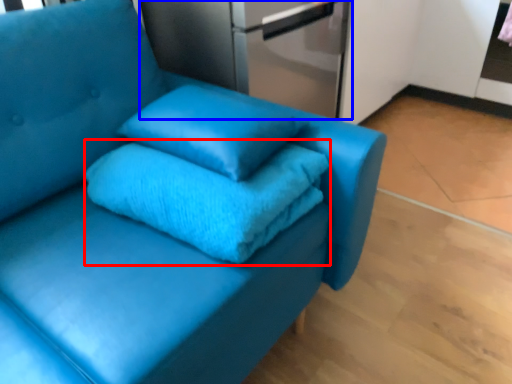
Question: Which of the following is the closest to the observer, bath towel (highlighted by a red box) or appliance (highlighted by a blue box)?

Choices:
 (A) bath towel
 (B) appliance

Answer: (A)